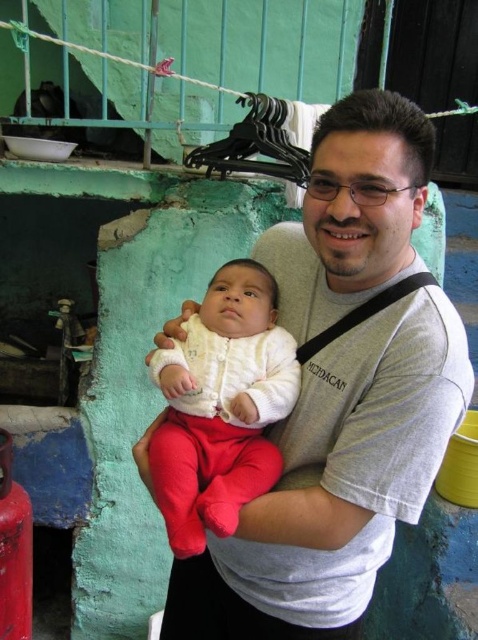
Does gray cotton shirt at center have a larger size compared to white soft baby at center?

Yes.

Is point (434, 337) farther from camera compared to point (158, 436)?

That is False.

Is point (329, 241) more distant than point (186, 552)?

Yes, point (329, 241) is behind point (186, 552).

Find the location of a particular element. gray cotton shirt at center is located at coordinates (336, 483).